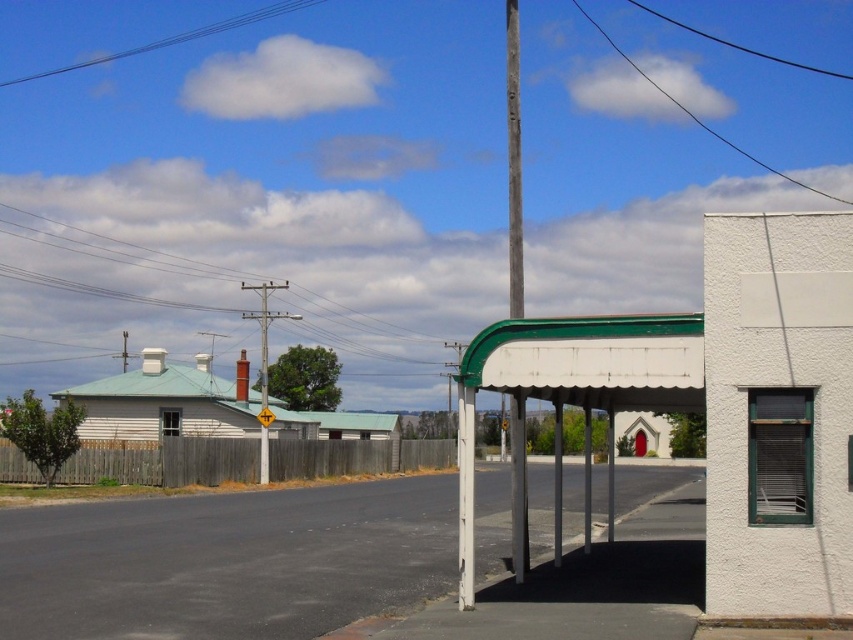
Question: Which point is farther to the camera?

Choices:
 (A) metallic wire at upper center
 (B) yellow plastic sign at center

Answer: (A)

Question: Estimate the real-world distances between objects in this image. Which object is closer to the white metal bus stop at center?

Choices:
 (A) black wire at upper center
 (B) clear blue wires at upper center
 (C) white matte canopy at center

Answer: (C)

Question: Can you confirm if metallic wire at upper center is bigger than black wire at upper center?

Choices:
 (A) yes
 (B) no

Answer: (A)

Question: Is the position of white matte canopy at center more distant than that of black wire at upper center?

Choices:
 (A) no
 (B) yes

Answer: (A)

Question: Which is farther from the black wire at upper center?

Choices:
 (A) white metal bus stop at center
 (B) wooden telegraph pole at center

Answer: (A)

Question: Is clear blue wires at upper center to the left of wooden telegraph pole at center from the viewer's perspective?

Choices:
 (A) no
 (B) yes

Answer: (B)